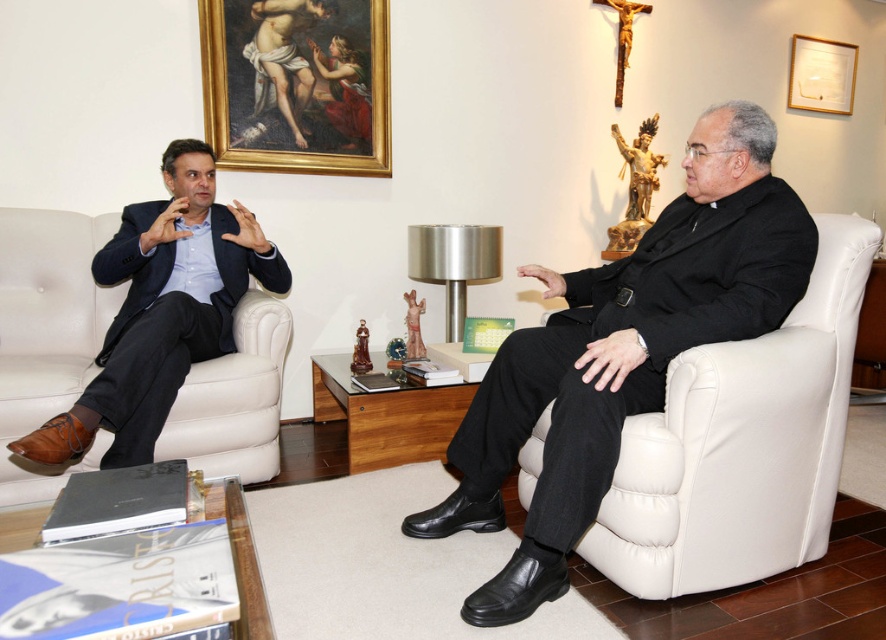
Which is more to the right, black leather suit at right or gold-framed painting at upper center?

Positioned to the right is black leather suit at right.

Between point (751, 172) and point (234, 60), which one is positioned in front?

Point (751, 172) is in front.

Describe the element at coordinates (622, 353) in the screenshot. I see `black leather suit at right` at that location.

Image resolution: width=886 pixels, height=640 pixels. I want to click on black leather suit at right, so point(622,353).

Based on the photo, can you confirm if white leather armchair at right is positioned above wooden picture frame at upper right?

No.

Between point (786, 470) and point (830, 88), which one is positioned behind?

The point (830, 88) is behind.

Locate an element on the screen. The height and width of the screenshot is (640, 886). white leather armchair at right is located at coordinates (741, 444).

Can you confirm if brown leather shoes at left is smaller than wooden picture frame at upper right?

Incorrect, brown leather shoes at left is not smaller in size than wooden picture frame at upper right.

Where is `brown leather shoes at left`? brown leather shoes at left is located at coordinates (161, 310).